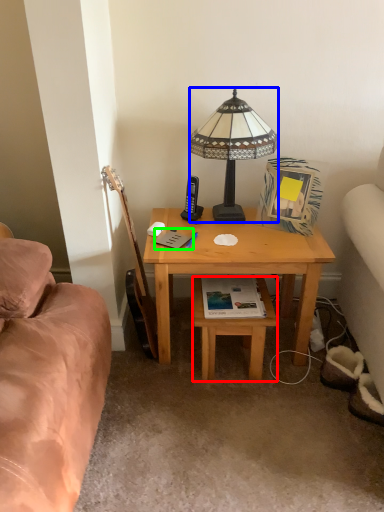
Question: Based on their relative distances, which object is nearer to stool (highlighted by a red box)? Choose from lamp (highlighted by a blue box) and book (highlighted by a green box).

Choices:
 (A) lamp
 (B) book

Answer: (B)